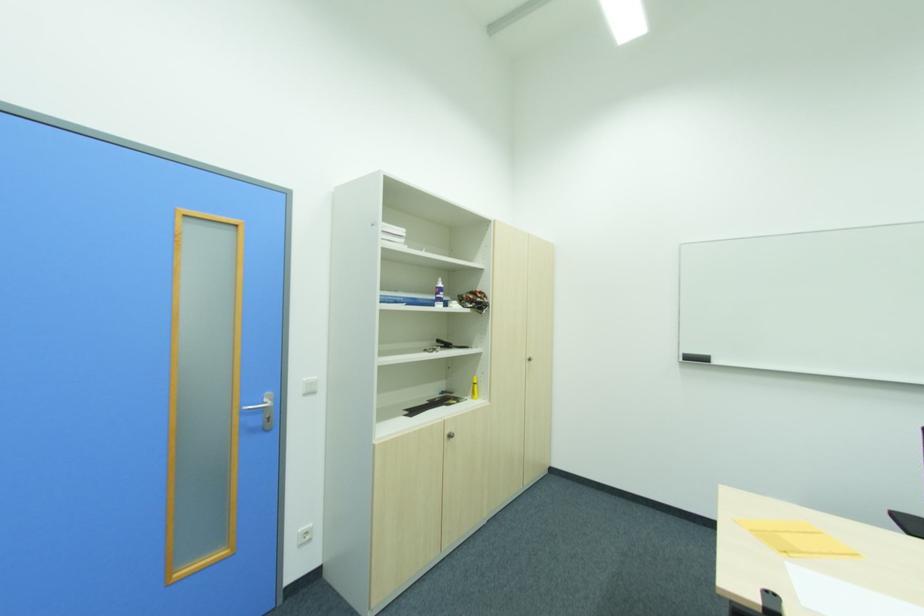
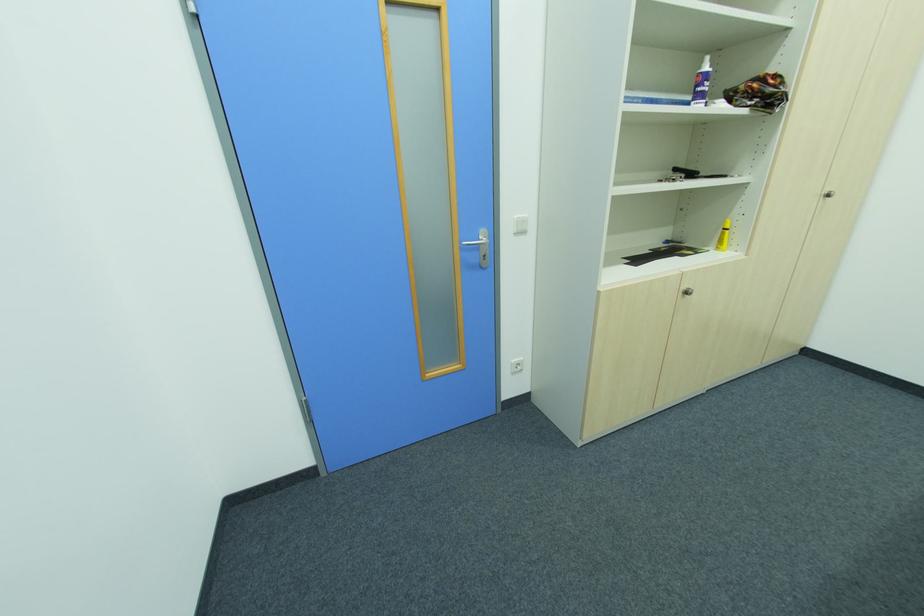
Question: I am providing you with two images of the same scene from different viewpoints. After the viewpoint changes to image2, which objects are now occluded?

Choices:
 (A) silver door handle
 (B) yellow bottle
 (C) metal cabinet knob
 (D) none of these

Answer: (D)